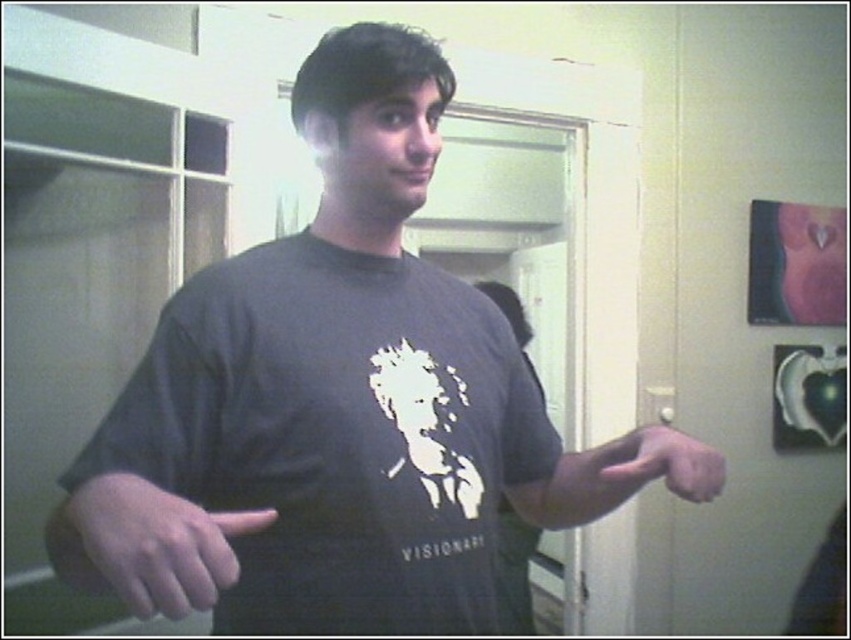
Question: Which point is closer to the camera taking this photo?

Choices:
 (A) (715, 476)
 (B) (486, 552)
 (C) (126, 497)

Answer: (C)

Question: Does dark gray t-shirt at center have a greater width compared to matte gray hand at lower right?

Choices:
 (A) yes
 (B) no

Answer: (A)

Question: Can you confirm if dark gray t-shirt at center is thinner than matte black hand at lower left?

Choices:
 (A) no
 (B) yes

Answer: (A)

Question: Which object is the farthest from the matte gray hand at lower right?

Choices:
 (A) dark gray t-shirt at center
 (B) matte black hand at lower left

Answer: (B)

Question: Which point is farther to the camera?

Choices:
 (A) (618, 476)
 (B) (121, 524)

Answer: (A)

Question: Is dark gray t-shirt at center further to camera compared to matte black hand at lower left?

Choices:
 (A) no
 (B) yes

Answer: (B)